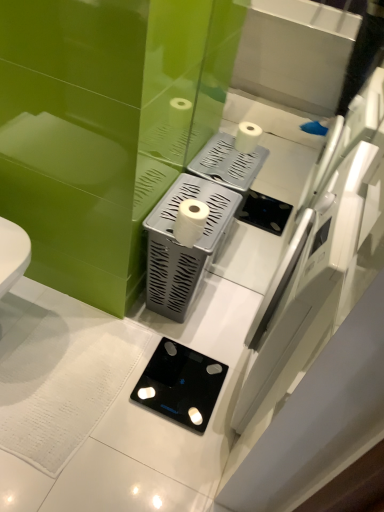
Identify the location of empty space that is ontop of black glass scale at lower center. (184, 378).